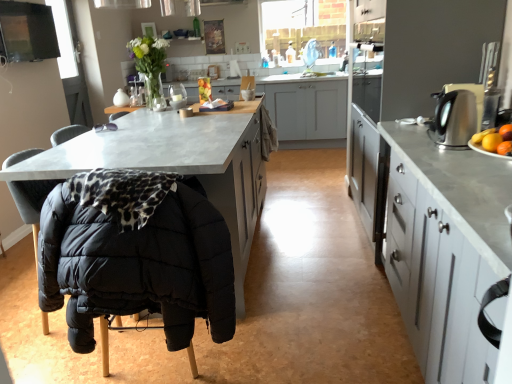
The width and height of the screenshot is (512, 384). I want to click on free space between matte gray cabinet at center, arranged as the second cabinetry when viewed from the front, and black quilted fabric folding chair at lower left, so click(123, 359).